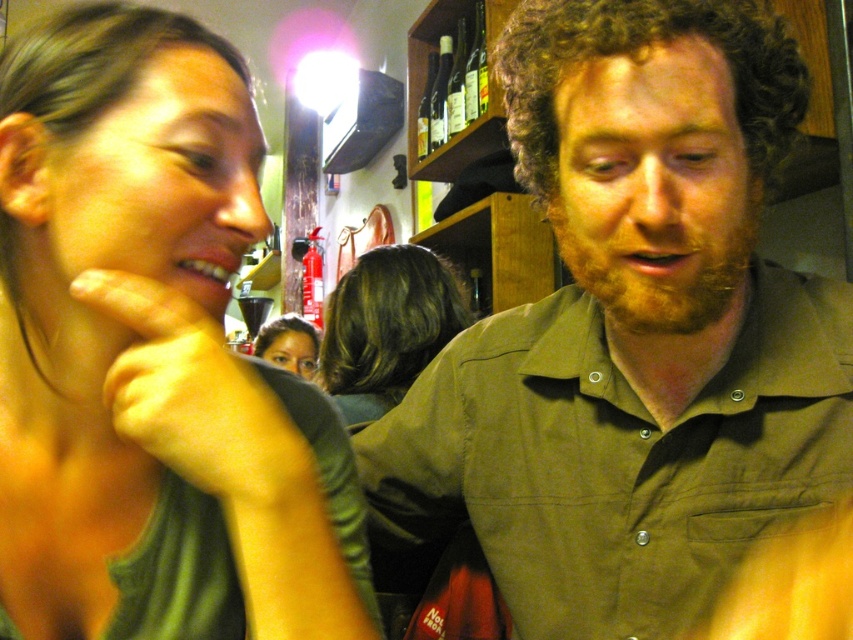
Does green matte shirt at upper left have a greater height compared to smooth skin face at center?

Indeed, green matte shirt at upper left has a greater height compared to smooth skin face at center.

Consider the image. Who is shorter, green matte shirt at upper left or smooth skin face at center?

smooth skin face at center is shorter.

Is point (329, 492) positioned in front of point (286, 353)?

Yes, it is in front of point (286, 353).

Where is `green matte shirt at upper left`? The height and width of the screenshot is (640, 853). green matte shirt at upper left is located at coordinates (151, 356).

Which is above, matte skin hand at left or clear glass bottles at upper center?

clear glass bottles at upper center

Who is shorter, matte skin hand at left or clear glass bottles at upper center?

matte skin hand at left

Does point (181, 364) lie in front of point (425, 92)?

Yes, point (181, 364) is in front of point (425, 92).

Where is `matte skin hand at left`? This screenshot has width=853, height=640. matte skin hand at left is located at coordinates (196, 397).

Who is more forward, (544, 12) or (206, 467)?

Positioned in front is point (206, 467).

Between green cotton shirt at center and green matte shirt at upper left, which one is positioned higher?

green matte shirt at upper left

Who is more distant from viewer, (813, 397) or (254, 403)?

The point (813, 397) is behind.

In order to click on green cotton shirt at center in this screenshot , I will do `click(633, 333)`.